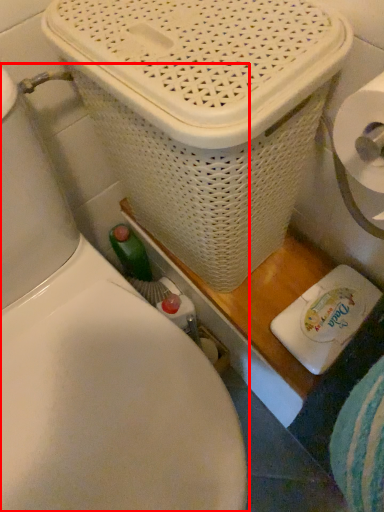
Question: From the image's perspective, where is toilet (annotated by the red box) located relative to basket container?

Choices:
 (A) below
 (B) above

Answer: (A)